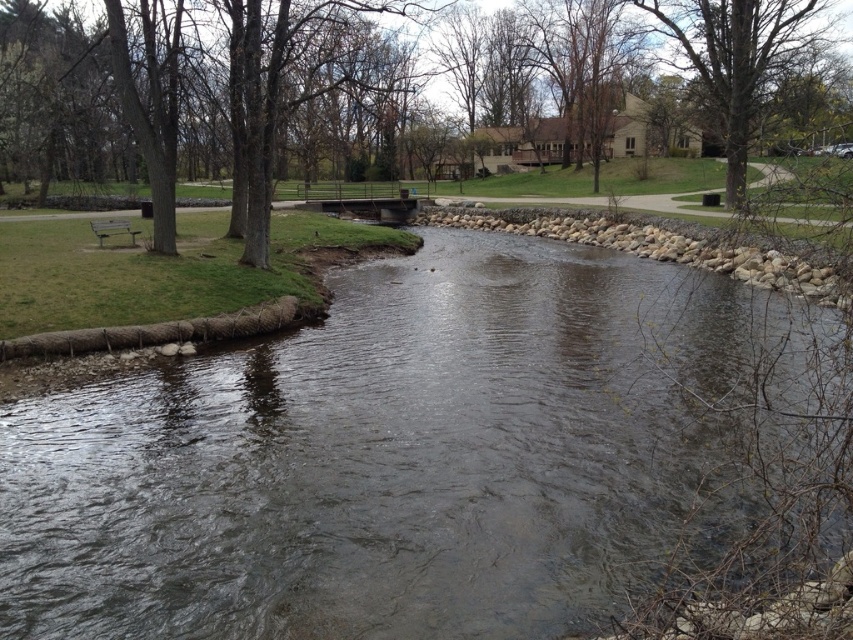
Question: Does brown wood tree at upper center have a lesser width compared to metallic silver bench at left?

Choices:
 (A) no
 (B) yes

Answer: (A)

Question: Which object is farther from the camera taking this photo?

Choices:
 (A) metallic silver bench at left
 (B) clear water at center

Answer: (A)

Question: Estimate the real-world distances between objects in this image. Which object is closer to the metallic silver bench at left?

Choices:
 (A) brown wood tree at upper center
 (B) clear water at center
 (C) bare brown tree at upper center

Answer: (B)

Question: Can you confirm if clear water at center is bigger than bare brown tree at upper center?

Choices:
 (A) no
 (B) yes

Answer: (A)

Question: Which of the following is the closest to the observer?

Choices:
 (A) (686, 44)
 (B) (305, 44)
 (C) (625, 419)

Answer: (C)

Question: Is bare brown tree at upper center in front of metallic silver bench at left?

Choices:
 (A) no
 (B) yes

Answer: (A)